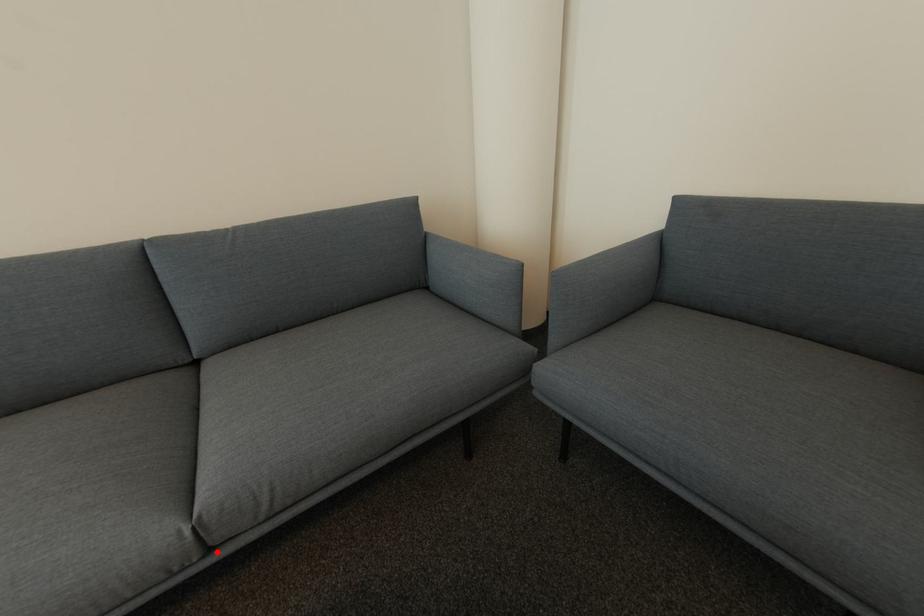
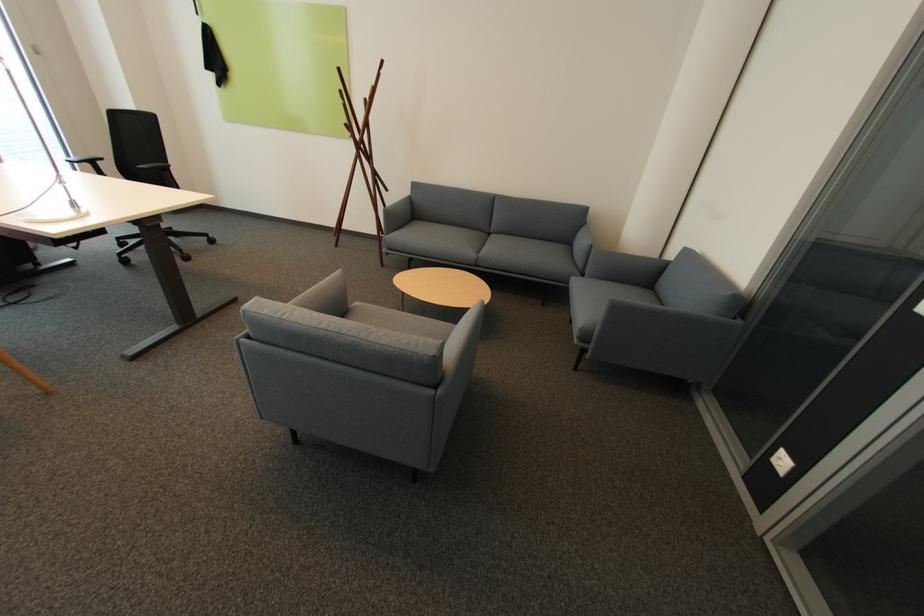
Locate, in the second image, the point that corresponds to the highlighted location in the first image.

(482, 265)